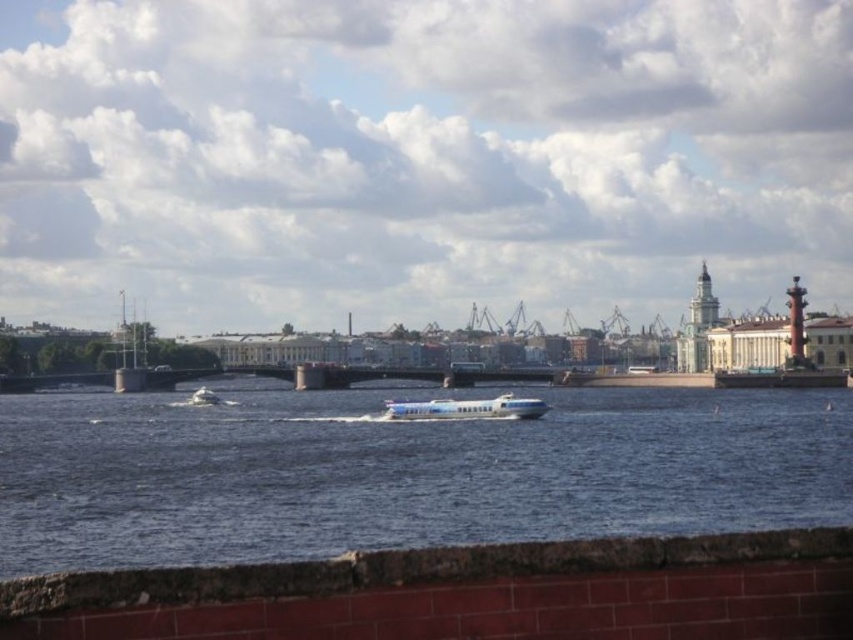
Question: Among these objects, which one is farthest from the camera?

Choices:
 (A) blue water at center
 (B) white glossy boat at center

Answer: (B)

Question: Is blue water at center thinner than white glossy boat at center?

Choices:
 (A) yes
 (B) no

Answer: (B)

Question: Which of the following is the farthest from the observer?

Choices:
 (A) (403, 412)
 (B) (247, 516)

Answer: (A)

Question: Is blue water at center to the right of white glossy boat at center from the viewer's perspective?

Choices:
 (A) yes
 (B) no

Answer: (A)

Question: Which object is farther from the camera taking this photo?

Choices:
 (A) white glossy boat at center
 (B) blue water at center

Answer: (A)

Question: Can you confirm if blue water at center is positioned below white glossy boat at center?

Choices:
 (A) yes
 (B) no

Answer: (A)